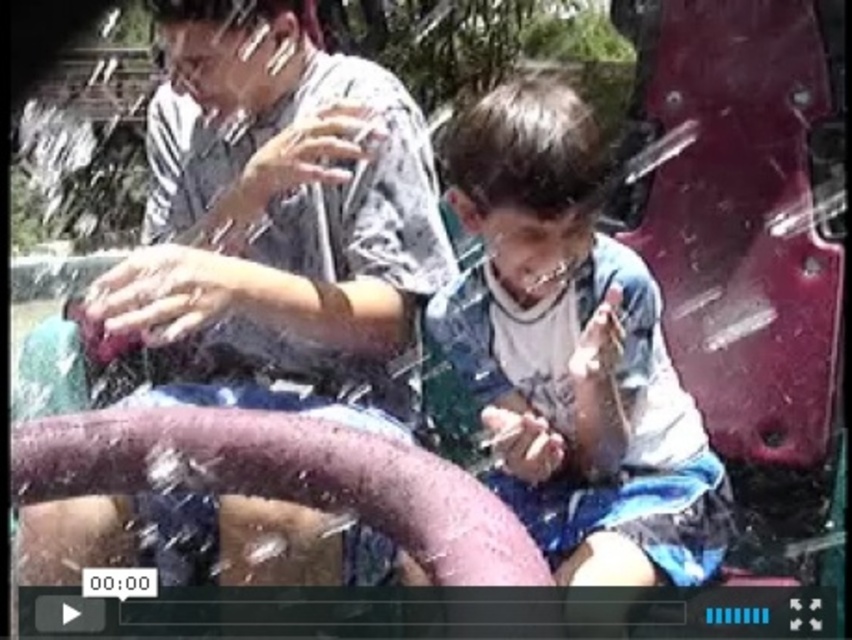
Who is positioned more to the right, matte gray shirt at center or blue denim shorts at center?

From the viewer's perspective, blue denim shorts at center appears more on the right side.

Is point (295, 358) more distant than point (591, 570)?

Yes, it is behind point (591, 570).

Where is `matte gray shirt at center`? matte gray shirt at center is located at coordinates (281, 228).